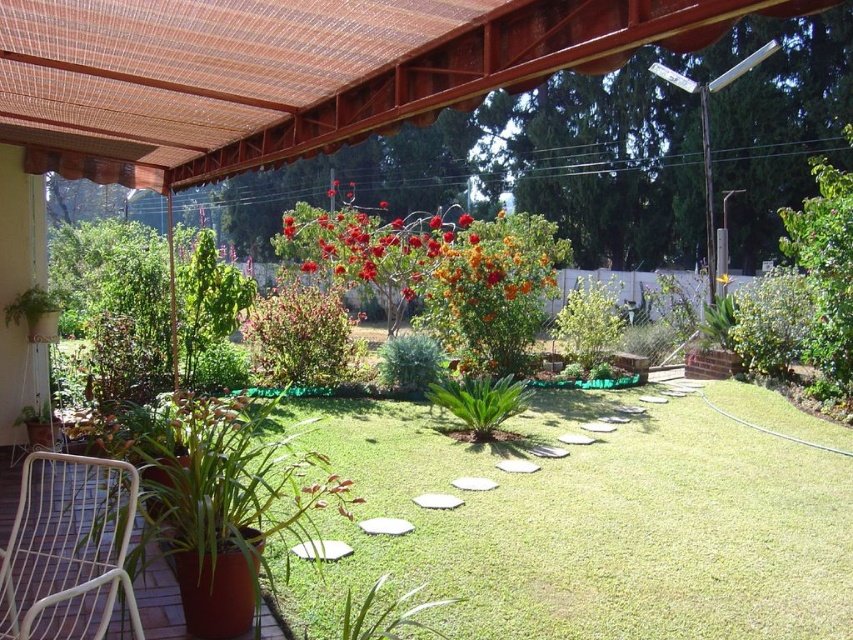
From the picture: Who is more distant from viewer, (x=199, y=35) or (x=715, y=276)?

Point (x=715, y=276)

Between brown woven pergola at upper center and yellow matte flower at center, which one appears on the left side from the viewer's perspective?

Positioned to the left is brown woven pergola at upper center.

The width and height of the screenshot is (853, 640). What do you see at coordinates (294, 72) in the screenshot?
I see `brown woven pergola at upper center` at bounding box center [294, 72].

Where is `brown woven pergola at upper center`? The height and width of the screenshot is (640, 853). brown woven pergola at upper center is located at coordinates (294, 72).

Which is above, vibrant orange petals at center or yellow matte flower at center?

vibrant orange petals at center is higher up.

Between point (418, 294) and point (720, 280), which one is positioned behind?

The point (720, 280) is more distant.

Locate an element on the screen. This screenshot has height=640, width=853. vibrant orange petals at center is located at coordinates (401, 244).

Is brown woven pergola at upper center further to the viewer compared to white wicker chair at lower left?

No, brown woven pergola at upper center is in front of white wicker chair at lower left.

Can you confirm if brown woven pergola at upper center is positioned below white wicker chair at lower left?

Actually, brown woven pergola at upper center is above white wicker chair at lower left.

Describe the element at coordinates (294, 72) in the screenshot. The image size is (853, 640). I see `brown woven pergola at upper center` at that location.

At what (x,y) coordinates should I click in order to perform the action: click on brown woven pergola at upper center. Please return your answer as a coordinate pair (x, y). Image resolution: width=853 pixels, height=640 pixels. Looking at the image, I should click on (294, 72).